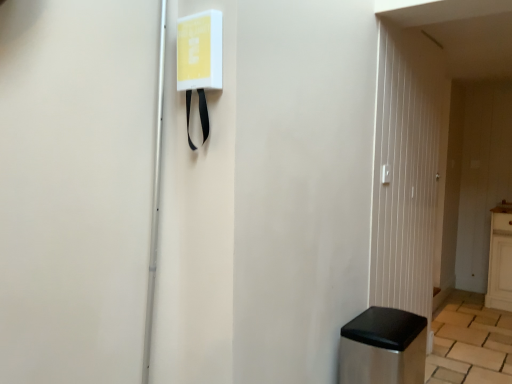
What do you see at coordinates (383, 348) in the screenshot?
I see `stainless steel trash can at lower right` at bounding box center [383, 348].

Locate an element on the screen. This screenshot has width=512, height=384. stainless steel trash can at lower right is located at coordinates (383, 348).

Find the location of a particular element. Image resolution: width=512 pixels, height=384 pixels. white plastic light switch at upper right is located at coordinates (386, 174).

Can you confirm if transparent glass door at right is bigger than white plastic light switch at upper right?

Yes, transparent glass door at right is bigger than white plastic light switch at upper right.

I want to click on glass door that appears below the white plastic light switch at upper right (from the image's perspective), so click(x=406, y=169).

From the image's perspective, is transparent glass door at right below white plastic light switch at upper right?

Yes, from the image's perspective, transparent glass door at right is below white plastic light switch at upper right.

In the scene shown: Considering the positions of objects transparent glass door at right and white plastic light switch at upper right in the image provided, who is more to the left, transparent glass door at right or white plastic light switch at upper right?

From the viewer's perspective, white plastic light switch at upper right appears more on the left side.

Considering the positions of point (390, 173) and point (384, 322), is point (390, 173) closer or farther from the camera than point (384, 322)?

Point (390, 173) is farther from the camera than point (384, 322).

Identify the location of light switch on the right side of stainless steel trash can at lower right. (386, 174).

Is white plastic light switch at upper right surrounding stainless steel trash can at lower right?

No, stainless steel trash can at lower right is not surrounded by white plastic light switch at upper right.

Considering the sizes of objects stainless steel trash can at lower right and transparent glass door at right in the image provided, who is shorter, stainless steel trash can at lower right or transparent glass door at right?

stainless steel trash can at lower right.

How distant is stainless steel trash can at lower right from transparent glass door at right?

A distance of 29.38 inches exists between stainless steel trash can at lower right and transparent glass door at right.

Can you confirm if stainless steel trash can at lower right is bigger than transparent glass door at right?

No.

This screenshot has height=384, width=512. I want to click on glass door that is above the stainless steel trash can at lower right (from a real-world perspective), so click(x=406, y=169).

This screenshot has height=384, width=512. I want to click on glass door below the white plastic light switch at upper right (from a real-world perspective), so click(406, 169).

How many degrees apart are the facing directions of white plastic light switch at upper right and transparent glass door at right?

They differ by 6.83 degrees in their facing directions.

Is white plastic light switch at upper right not inside transparent glass door at right?

No, white plastic light switch at upper right is inside or overlapping with transparent glass door at right.

From the image's perspective, does white plastic light switch at upper right appear lower than transparent glass door at right?

Actually, white plastic light switch at upper right appears above transparent glass door at right in the image.

Who is taller, stainless steel trash can at lower right or white plastic light switch at upper right?

Standing taller between the two is stainless steel trash can at lower right.

Is stainless steel trash can at lower right oriented away from white plastic light switch at upper right?

That's not correct — stainless steel trash can at lower right is not looking away from white plastic light switch at upper right.

Considering the relative positions of stainless steel trash can at lower right and white plastic light switch at upper right in the image provided, is stainless steel trash can at lower right to the left or to the right of white plastic light switch at upper right?

Based on their positions, stainless steel trash can at lower right is located to the left of white plastic light switch at upper right.

Is stainless steel trash can at lower right touching white plastic light switch at upper right?

No, stainless steel trash can at lower right is not touching white plastic light switch at upper right.

From a real-world perspective, is transparent glass door at right on top of stainless steel trash can at lower right?

Yes.

Considering the sizes of transparent glass door at right and stainless steel trash can at lower right in the image, is transparent glass door at right bigger or smaller than stainless steel trash can at lower right?

Considering their sizes, transparent glass door at right takes up more space than stainless steel trash can at lower right.

Locate an element on the screen. glass door that appears on the right of stainless steel trash can at lower right is located at coordinates (406, 169).

Locate an element on the screen. This screenshot has height=384, width=512. glass door that appears below the white plastic light switch at upper right (from the image's perspective) is located at coordinates (406, 169).

You are a GUI agent. You are given a task and a screenshot of the screen. Output one action in this format:
    pyautogui.click(x=<x>, y=<y>)
    Task: Click on the furniture in front of the white plastic light switch at upper right
    This screenshot has height=384, width=512.
    Given the screenshot: What is the action you would take?
    pyautogui.click(x=383, y=348)

Looking at this image, based on their spatial positions, is white plastic light switch at upper right or transparent glass door at right closer to stainless steel trash can at lower right?

transparent glass door at right is closer to stainless steel trash can at lower right.

From the image, which object appears to be nearer to transparent glass door at right, white plastic light switch at upper right or stainless steel trash can at lower right?

Based on the image, white plastic light switch at upper right appears to be nearer to transparent glass door at right.

Looking at the image, which one is located closer to white plastic light switch at upper right, stainless steel trash can at lower right or transparent glass door at right?

transparent glass door at right is closer to white plastic light switch at upper right.

Looking at the image, which one is located closer to transparent glass door at right, stainless steel trash can at lower right or white plastic light switch at upper right?

white plastic light switch at upper right is closer to transparent glass door at right.

When comparing their distances from stainless steel trash can at lower right, does transparent glass door at right or white plastic light switch at upper right seem further?

Among the two, white plastic light switch at upper right is located further to stainless steel trash can at lower right.

From the image, which object appears to be nearer to white plastic light switch at upper right, transparent glass door at right or stainless steel trash can at lower right?

transparent glass door at right is positioned closer to the anchor white plastic light switch at upper right.

Where is `glass door that lies between white plastic light switch at upper right and stainless steel trash can at lower right from top to bottom`? Image resolution: width=512 pixels, height=384 pixels. glass door that lies between white plastic light switch at upper right and stainless steel trash can at lower right from top to bottom is located at coordinates (406, 169).